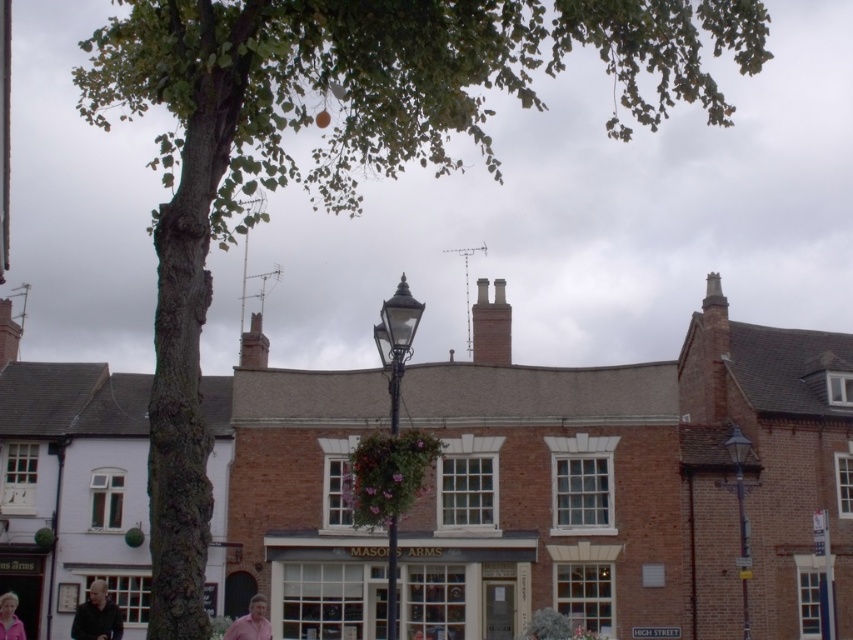
You are standing at the center of the image. Which direction should you move to reach the matte black lamp post at right?

Since the matte black lamp post at right is located at point (741, 515), you should move to the right to reach it.

In the scene shown: You are standing at the entrance of the traditional brick building with a curved roofline. You want to place a new decorative flower basket on the lamppost. The flower basket is 0.5 meters in diameter. Can you determine if the point at coordinates (741,515) on the lamppost is suitable for hanging the basket?

The point at coordinates (741,515) corresponds to the matte black lamp post at right. Since the flower basket is 0.5 meters in diameter, it will fit as long as there is sufficient space and structural support at that point on the lamppost. However, without specific measurements of the lamppost arm or hook capacity, it is recommended to ensure the location can safely accommodate the basket.

You are a delivery person trying to park your bike near the pink fabric at lower left. However, there is a matte black lamp post at right in the way. Can you park your bike there without hitting the lamp post?

The matte black lamp post at right is located above the pink fabric at lower left, so the lamp post is positioned higher up. Since the pink fabric at lower left is lower down, you can park your bike there without hitting the lamp post as they are at different heights.